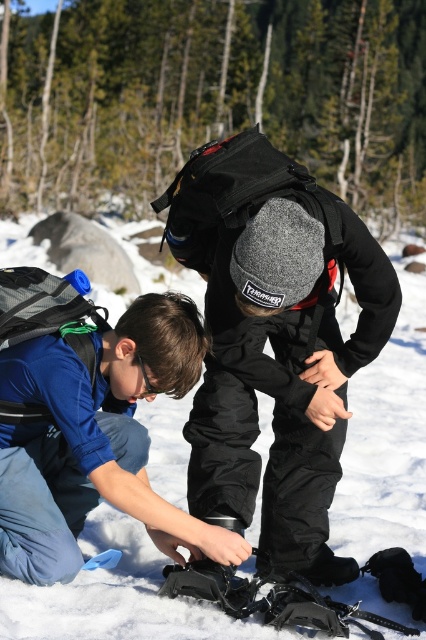
Which of these two, white fluffy snow at center or black plastic snowshoe at lower center, stands taller?

white fluffy snow at center is taller.

Can you confirm if white fluffy snow at center is taller than black plastic snowshoe at lower center?

Yes, white fluffy snow at center is taller than black plastic snowshoe at lower center.

Is point (267, 403) closer to viewer compared to point (209, 589)?

No, it is not.

Where is `white fluffy snow at center`? The image size is (426, 640). white fluffy snow at center is located at coordinates (386, 436).